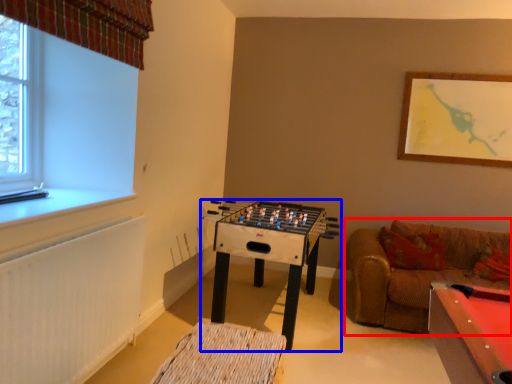
Question: Among these objects, which one is nearest to the camera, studio couch (highlighted by a red box) or table (highlighted by a blue box)?

Choices:
 (A) studio couch
 (B) table

Answer: (A)